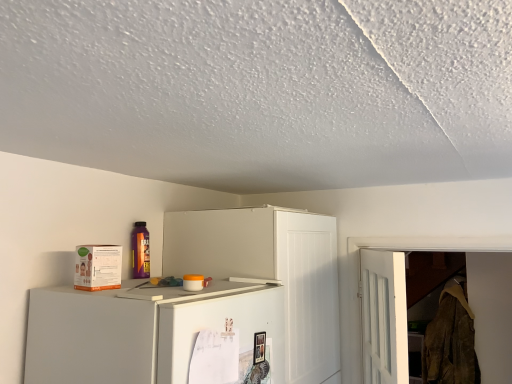
Question: Should I look upward or downward to see white matte cabinet at upper center?

Choices:
 (A) down
 (B) up

Answer: (A)

Question: From the image's perspective, is brown textured fabric at right over white matte cabinet at upper center?

Choices:
 (A) yes
 (B) no

Answer: (B)

Question: Is white matte cabinet at upper center a part of brown textured fabric at right?

Choices:
 (A) yes
 (B) no

Answer: (B)

Question: Is brown textured fabric at right next to white matte cabinet at upper center?

Choices:
 (A) no
 (B) yes

Answer: (A)

Question: Considering the relative sizes of brown textured fabric at right and white matte cabinet at upper center in the image provided, is brown textured fabric at right thinner than white matte cabinet at upper center?

Choices:
 (A) yes
 (B) no

Answer: (A)

Question: Can you confirm if brown textured fabric at right is positioned to the right of white matte cabinet at upper center?

Choices:
 (A) no
 (B) yes

Answer: (B)

Question: Is brown textured fabric at right facing away from white matte cabinet at upper center?

Choices:
 (A) yes
 (B) no

Answer: (B)

Question: Is white matte cabinet at upper center facing towards brown textured fabric at right?

Choices:
 (A) no
 (B) yes

Answer: (A)

Question: From the image's perspective, is white matte cabinet at upper center located beneath brown textured fabric at right?

Choices:
 (A) no
 (B) yes

Answer: (A)

Question: Considering the relative sizes of white matte cabinet at upper center and brown textured fabric at right in the image provided, is white matte cabinet at upper center smaller than brown textured fabric at right?

Choices:
 (A) no
 (B) yes

Answer: (A)

Question: From a real-world perspective, does white matte cabinet at upper center stand above brown textured fabric at right?

Choices:
 (A) yes
 (B) no

Answer: (A)

Question: From the image's perspective, is white matte cabinet at upper center on brown textured fabric at right?

Choices:
 (A) yes
 (B) no

Answer: (A)

Question: Considering the relative positions of white matte cabinet at upper center and brown textured fabric at right in the image provided, is white matte cabinet at upper center to the left of brown textured fabric at right from the viewer's perspective?

Choices:
 (A) yes
 (B) no

Answer: (A)

Question: Looking at their shapes, would you say white matte cabinet at upper center is wider or thinner than brown textured fabric at right?

Choices:
 (A) thin
 (B) wide

Answer: (B)